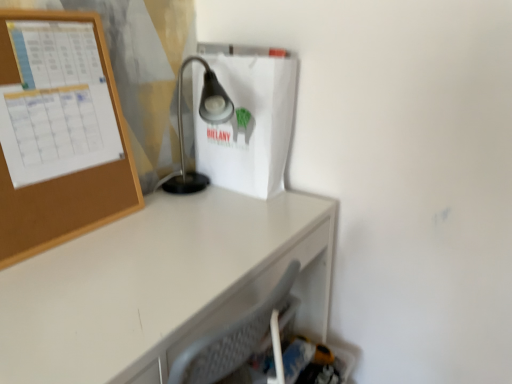
Question: Considering the relative sizes of white glossy desk at center and satin black lamp at center in the image provided, is white glossy desk at center taller than satin black lamp at center?

Choices:
 (A) yes
 (B) no

Answer: (A)

Question: Considering the relative sizes of white glossy desk at center and satin black lamp at center in the image provided, is white glossy desk at center wider than satin black lamp at center?

Choices:
 (A) no
 (B) yes

Answer: (B)

Question: Is satin black lamp at center at the back of white glossy desk at center?

Choices:
 (A) yes
 (B) no

Answer: (B)

Question: Can you confirm if white glossy desk at center is smaller than satin black lamp at center?

Choices:
 (A) no
 (B) yes

Answer: (A)

Question: Considering the relative positions of white glossy desk at center and satin black lamp at center in the image provided, is white glossy desk at center to the left of satin black lamp at center from the viewer's perspective?

Choices:
 (A) no
 (B) yes

Answer: (B)

Question: From a real-world perspective, relative to satin black lamp at center, is white matte paper bag at center vertically above or below?

Choices:
 (A) above
 (B) below

Answer: (A)

Question: From the image's perspective, is white matte paper bag at center above or below satin black lamp at center?

Choices:
 (A) below
 (B) above

Answer: (B)

Question: Considering the positions of point (266, 132) and point (211, 97), is point (266, 132) closer or farther from the camera than point (211, 97)?

Choices:
 (A) farther
 (B) closer

Answer: (A)

Question: Choose the correct answer: Is white matte paper bag at center inside satin black lamp at center or outside it?

Choices:
 (A) outside
 (B) inside

Answer: (A)

Question: In terms of width, does satin black lamp at center look wider or thinner when compared to white glossy desk at center?

Choices:
 (A) thin
 (B) wide

Answer: (A)

Question: Visually, is satin black lamp at center positioned to the left or to the right of white glossy desk at center?

Choices:
 (A) left
 (B) right

Answer: (B)

Question: From their relative heights in the image, would you say satin black lamp at center is taller or shorter than white glossy desk at center?

Choices:
 (A) short
 (B) tall

Answer: (A)

Question: Is satin black lamp at center inside the boundaries of white glossy desk at center, or outside?

Choices:
 (A) inside
 (B) outside

Answer: (B)

Question: In the image, is satin black lamp at center positioned in front of or behind white matte paper bag at center?

Choices:
 (A) front
 (B) behind

Answer: (A)

Question: From the image's perspective, is satin black lamp at center positioned above or below white matte paper bag at center?

Choices:
 (A) above
 (B) below

Answer: (B)